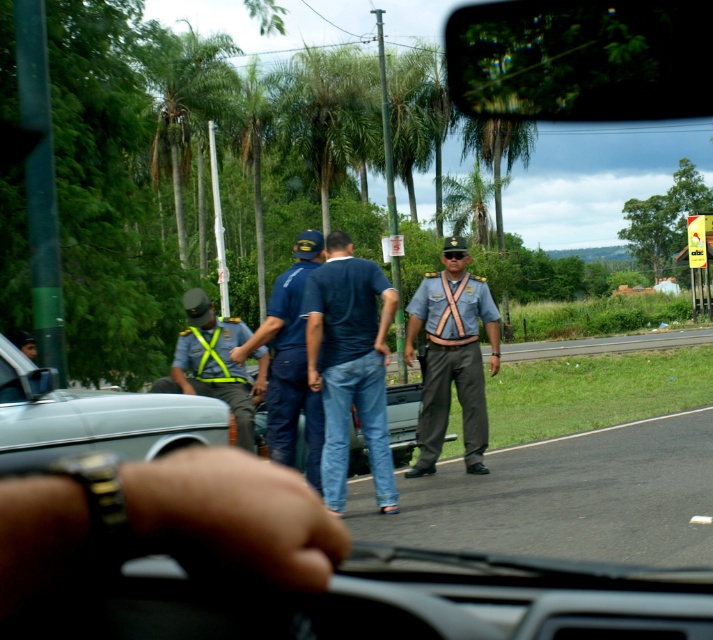
Question: Does green leafy palm tree at center appear under matte brown suspenders at center?

Choices:
 (A) yes
 (B) no

Answer: (B)

Question: Which point is closer to the camera?

Choices:
 (A) (436, 310)
 (B) (297, 300)

Answer: (B)

Question: Which point is closer to the camera?

Choices:
 (A) silver metallic car at left
 (B) dark blue jeans at center
 (C) green leafy palm tree at upper left
 (D) gray uniformed officer at center

Answer: (A)

Question: Which of the following is the farthest from the observer?

Choices:
 (A) (425, 438)
 (B) (466, 340)
 (C) (304, 145)

Answer: (C)

Question: Does dark blue jeans at center have a lesser width compared to green leafy palm tree at upper left?

Choices:
 (A) yes
 (B) no

Answer: (A)

Question: Is silver metallic car at left smaller than blue uniform at center?

Choices:
 (A) yes
 (B) no

Answer: (B)